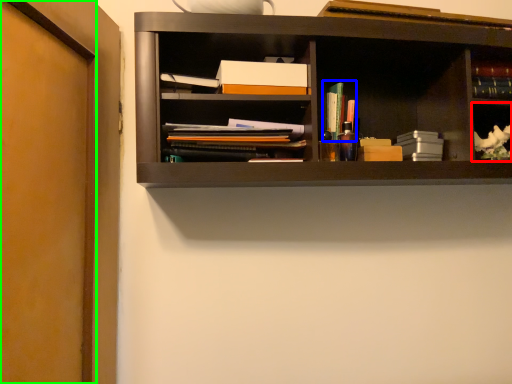
Question: Estimate the real-world distances between objects in this image. Which object is farther from cabinet (highlighted by a red box), book (highlighted by a blue box) or door (highlighted by a green box)?

Choices:
 (A) book
 (B) door

Answer: (B)